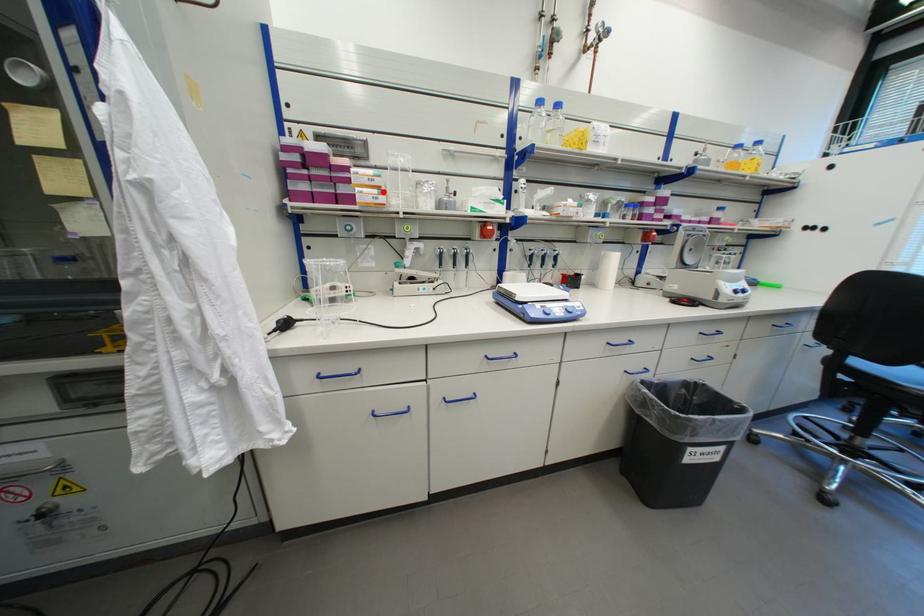
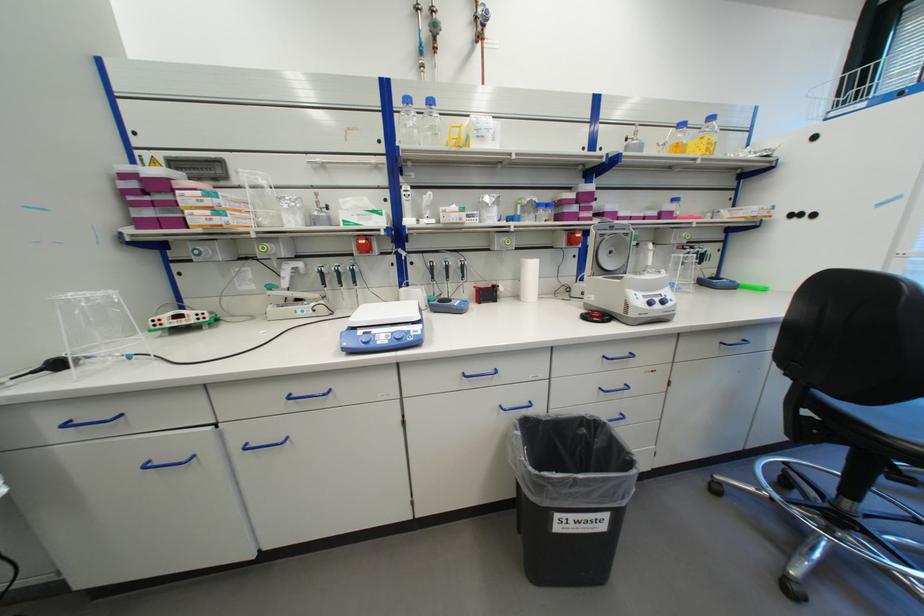
Locate, in the second image, the point that corresponds to the highlighted location in the first image.

(215, 213)